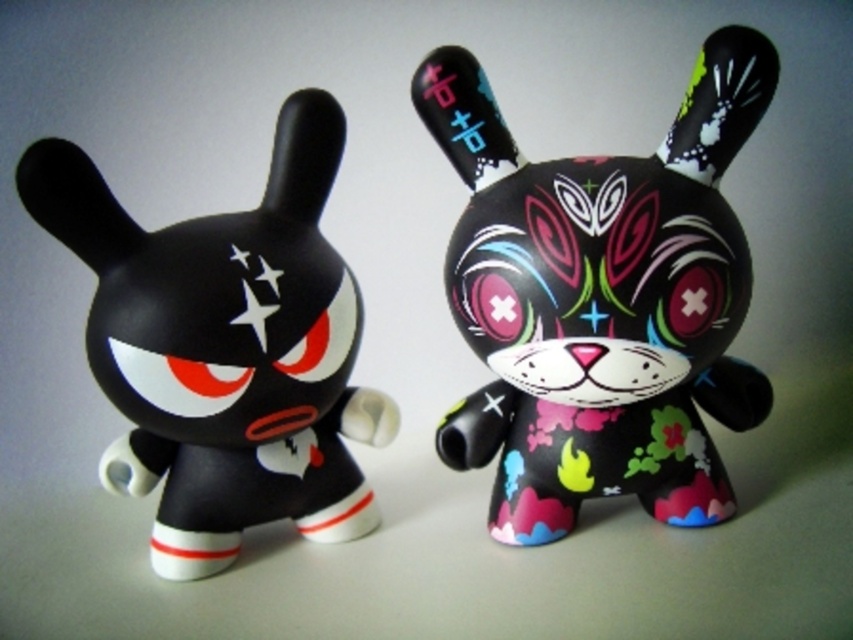
Is point (712, 458) positioned before point (273, 170)?

No, it is not.

Locate an element on the screen. The height and width of the screenshot is (640, 853). matte black rabbit at center is located at coordinates (601, 300).